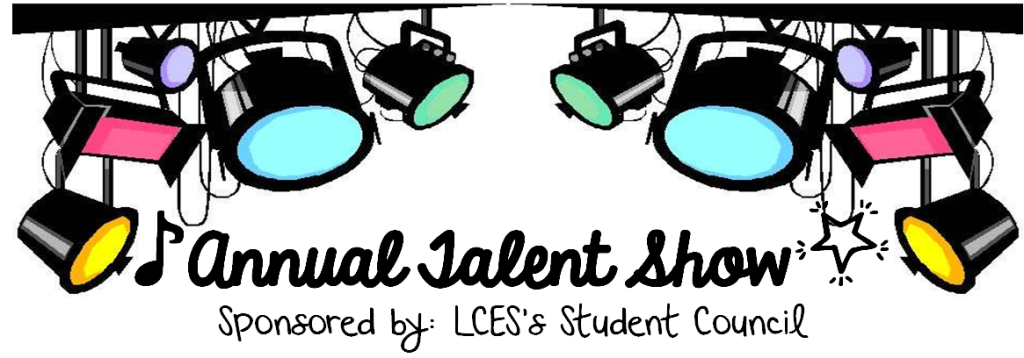
The width and height of the screenshot is (1024, 358). In order to click on pink light in this screenshot , I will do `click(135, 144)`.